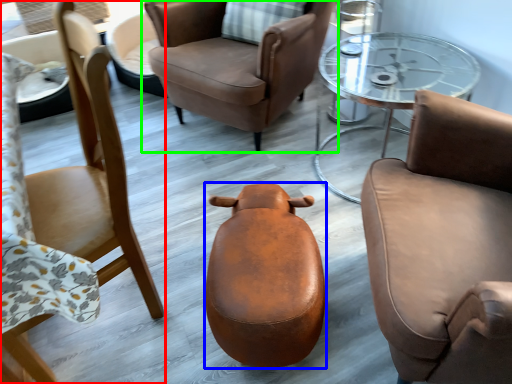
Question: Based on their relative distances, which object is farther from chair (highlighted by a red box)? Choose from stool (highlighted by a blue box) and chair (highlighted by a green box).

Choices:
 (A) stool
 (B) chair

Answer: (B)